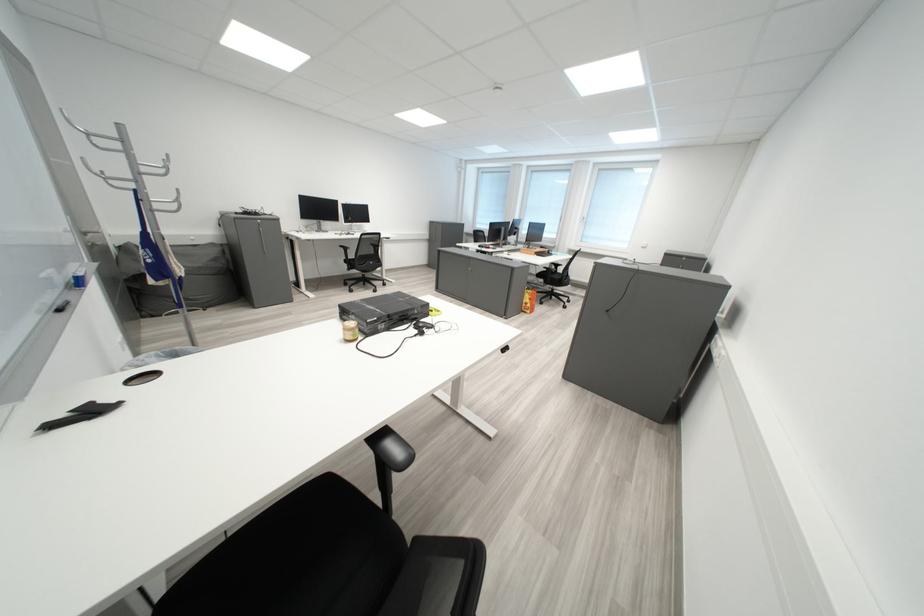
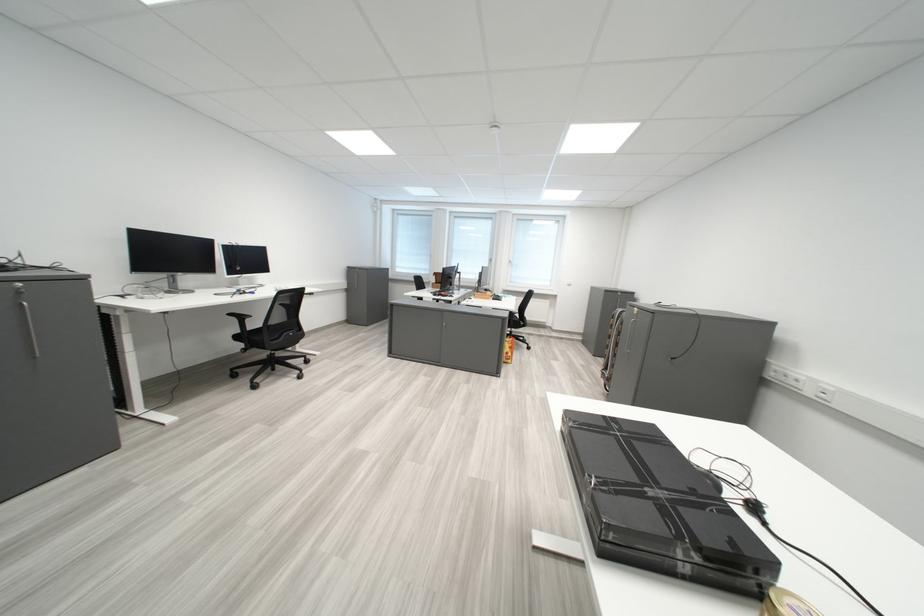
The point at (355,248) is marked in the first image. Where is the corresponding point in the second image?

(244, 317)